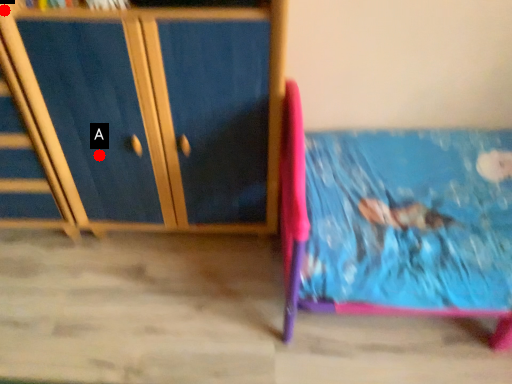
Question: Two points are circled on the image, labeled by A and B beside each circle. Among these points, which one is farthest from the camera?

Choices:
 (A) A is further
 (B) B is further

Answer: (A)